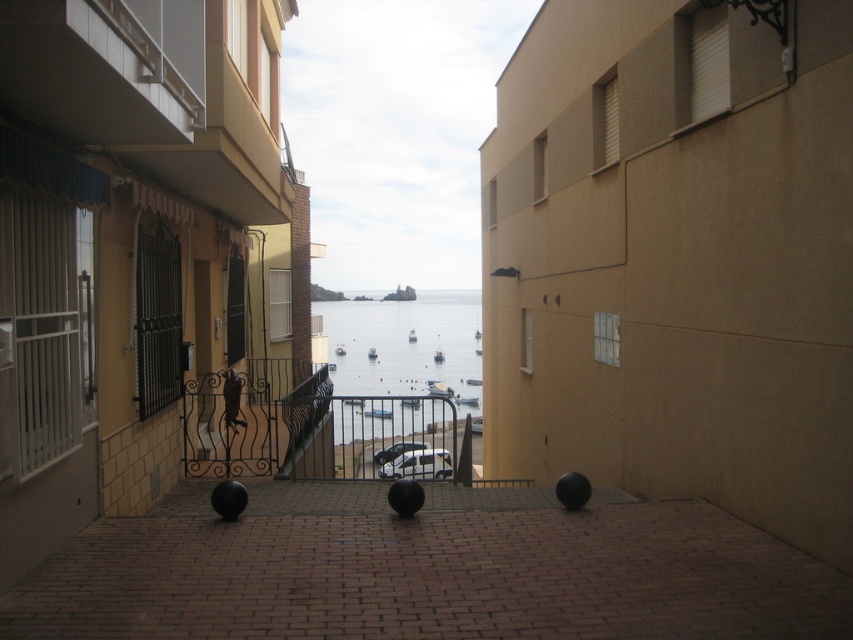
Is the position of transparent water at center less distant than that of wrought iron balustrade at center?

No, transparent water at center is behind wrought iron balustrade at center.

Between transparent water at center and wrought iron balustrade at center, which one appears on the right side from the viewer's perspective?

Positioned to the right is transparent water at center.

Is point (395, 388) behind point (218, 381)?

Yes, it is.

Identify the location of transparent water at center. The width and height of the screenshot is (853, 640). (405, 346).

Can you confirm if brown brick alley at center is smaller than metallic gray railing at center?

Yes.

Measure the distance from brown brick alley at center to metallic gray railing at center.

brown brick alley at center and metallic gray railing at center are 29.20 meters apart from each other.

Identify the location of brown brick alley at center. (427, 570).

Find the location of a particular element. The height and width of the screenshot is (640, 853). brown brick alley at center is located at coordinates (427, 570).

Between brown brick alley at center and white textured balcony at upper left, which one is positioned higher?

white textured balcony at upper left is above.

In the scene shown: Can you confirm if brown brick alley at center is positioned above white textured balcony at upper left?

Actually, brown brick alley at center is below white textured balcony at upper left.

Does point (355, 522) come farther from viewer compared to point (102, 52)?

Yes, it is.

Identify the location of brown brick alley at center. (427, 570).